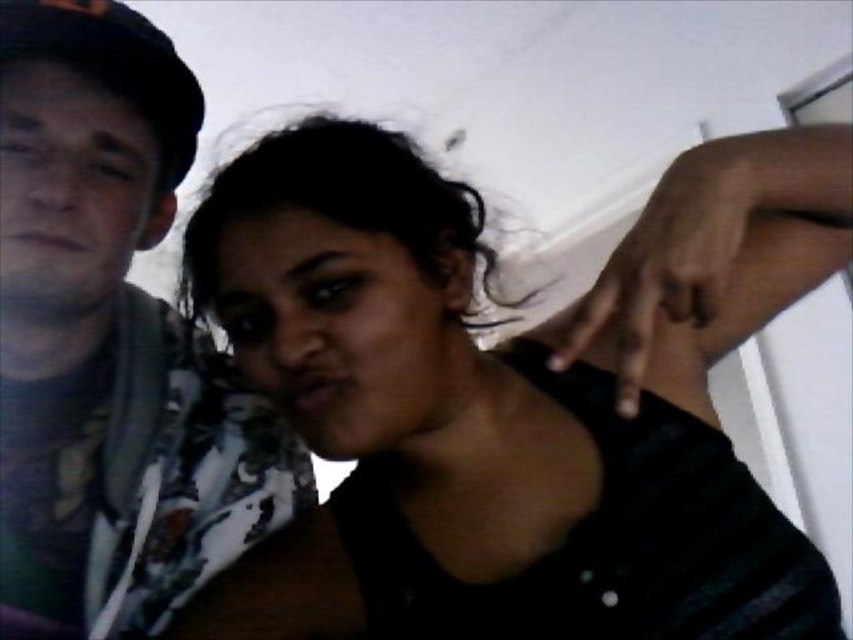
Question: Does black matte shirt at center appear under matte black shirt at left?

Choices:
 (A) yes
 (B) no

Answer: (A)

Question: Does black matte shirt at center appear on the left side of matte black shirt at left?

Choices:
 (A) yes
 (B) no

Answer: (B)

Question: Which object is closer to the camera taking this photo?

Choices:
 (A) black matte shirt at center
 (B) matte black shirt at left

Answer: (A)

Question: Considering the relative positions of black matte shirt at center and matte black shirt at left in the image provided, where is black matte shirt at center located with respect to matte black shirt at left?

Choices:
 (A) right
 (B) left

Answer: (A)

Question: Among these objects, which one is farthest from the camera?

Choices:
 (A) matte black shirt at left
 (B) black matte shirt at center

Answer: (A)